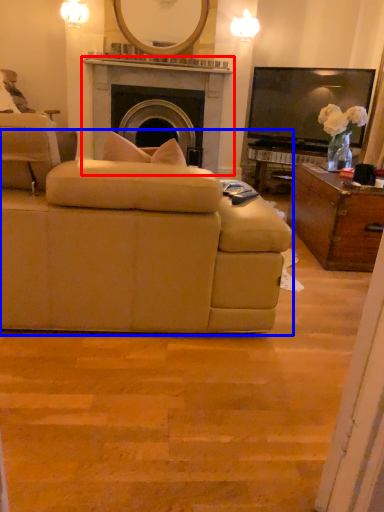
Question: Which of the following is the farthest to the observer, fireplace (highlighted by a red box) or studio couch (highlighted by a blue box)?

Choices:
 (A) fireplace
 (B) studio couch

Answer: (A)